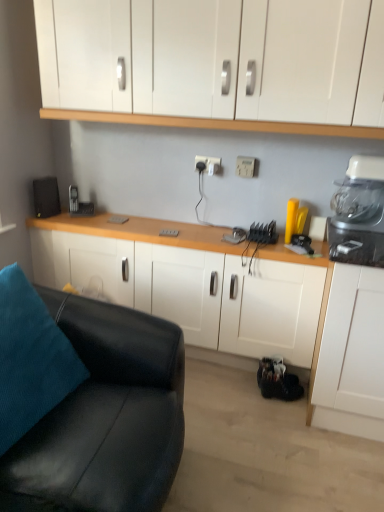
Question: Which direction should I rotate to look at white matte cabinet at center, positioned as the second cabinetry in top-to-bottom order, — up or down?

Choices:
 (A) down
 (B) up

Answer: (A)

Question: Is white glossy cabinets at upper center, which is counted as the second cabinetry, starting from the bottom, oriented away from teal fabric pillow at lower left?

Choices:
 (A) no
 (B) yes

Answer: (A)

Question: Is white glossy cabinets at upper center, the first cabinetry when ordered from top to bottom, bigger than teal fabric pillow at lower left?

Choices:
 (A) yes
 (B) no

Answer: (A)

Question: Are white glossy cabinets at upper center, which is counted as the second cabinetry, starting from the bottom, and teal fabric pillow at lower left far apart?

Choices:
 (A) yes
 (B) no

Answer: (A)

Question: Is white glossy cabinets at upper center, which is counted as the second cabinetry, starting from the bottom, thinner than teal fabric pillow at lower left?

Choices:
 (A) no
 (B) yes

Answer: (A)

Question: Can you confirm if white glossy cabinets at upper center, the first cabinetry when ordered from top to bottom, is positioned to the left of teal fabric pillow at lower left?

Choices:
 (A) no
 (B) yes

Answer: (A)

Question: From a real-world perspective, is white glossy cabinets at upper center, which is counted as the second cabinetry, starting from the bottom, over teal fabric pillow at lower left?

Choices:
 (A) no
 (B) yes

Answer: (B)

Question: Is white plastic electric outlet at center, acting as the first electric outlet starting from the right, oriented away from white plastic electric outlet at center, which appears as the second electric outlet when viewed from the right?

Choices:
 (A) yes
 (B) no

Answer: (B)

Question: Considering the relative sizes of white plastic electric outlet at center, which appears as the 2th electric outlet when viewed from the left, and white plastic electric outlet at center, which appears as the second electric outlet when viewed from the right, in the image provided, is white plastic electric outlet at center, which appears as the 2th electric outlet when viewed from the left, bigger than white plastic electric outlet at center, which appears as the second electric outlet when viewed from the right,?

Choices:
 (A) no
 (B) yes

Answer: (B)

Question: Is white plastic electric outlet at center, which appears as the 2th electric outlet when viewed from the left, thinner than white plastic electric outlet at center, the first electric outlet when ordered from left to right?

Choices:
 (A) no
 (B) yes

Answer: (A)

Question: Is white plastic electric outlet at center, which appears as the 2th electric outlet when viewed from the left, positioned before white plastic electric outlet at center, which appears as the second electric outlet when viewed from the right?

Choices:
 (A) no
 (B) yes

Answer: (B)

Question: Considering the relative sizes of white plastic electric outlet at center, acting as the first electric outlet starting from the right, and white plastic electric outlet at center, which appears as the second electric outlet when viewed from the right, in the image provided, is white plastic electric outlet at center, acting as the first electric outlet starting from the right, smaller than white plastic electric outlet at center, which appears as the second electric outlet when viewed from the right,?

Choices:
 (A) no
 (B) yes

Answer: (A)

Question: Is white plastic electric outlet at center, which appears as the 2th electric outlet when viewed from the left, positioned behind white plastic electric outlet at center, the first electric outlet when ordered from left to right?

Choices:
 (A) yes
 (B) no

Answer: (B)

Question: Is white plastic electric outlet at center, acting as the first electric outlet starting from the right, to the right of black leather couch at lower left from the viewer's perspective?

Choices:
 (A) yes
 (B) no

Answer: (A)